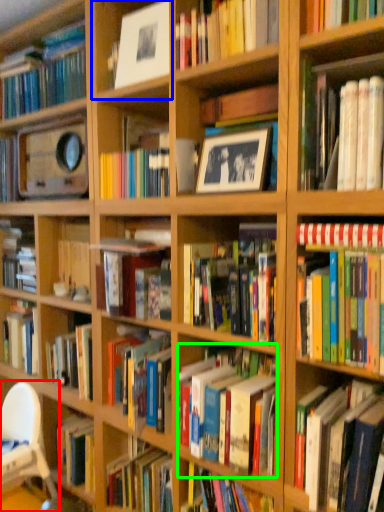
Question: Estimate the real-world distances between objects in this image. Which object is farther from chair (highlighted by a red box), shelf (highlighted by a blue box) or book (highlighted by a green box)?

Choices:
 (A) shelf
 (B) book

Answer: (A)